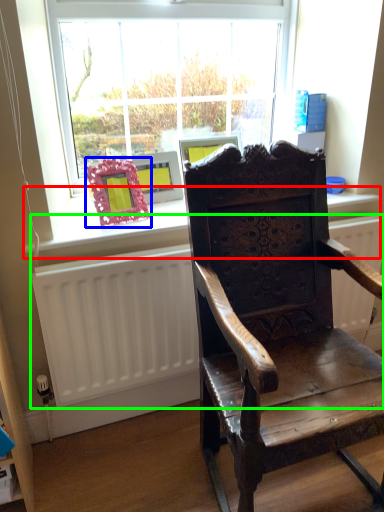
Question: Based on their relative distances, which object is farther from window sill (highlighted by a red box)? Choose from picture frame (highlighted by a blue box) and radiator (highlighted by a green box).

Choices:
 (A) picture frame
 (B) radiator

Answer: (B)